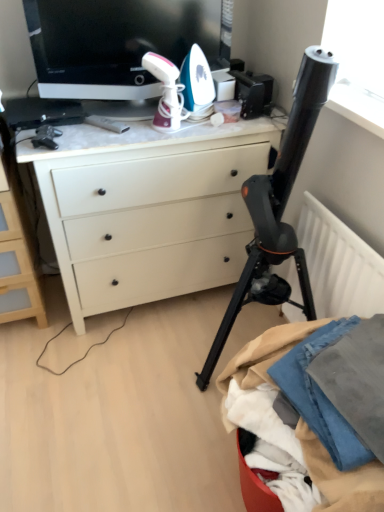
The image size is (384, 512). I want to click on free space that is in between white matte chest of drawers at left and white matte desk at center, so click(x=54, y=316).